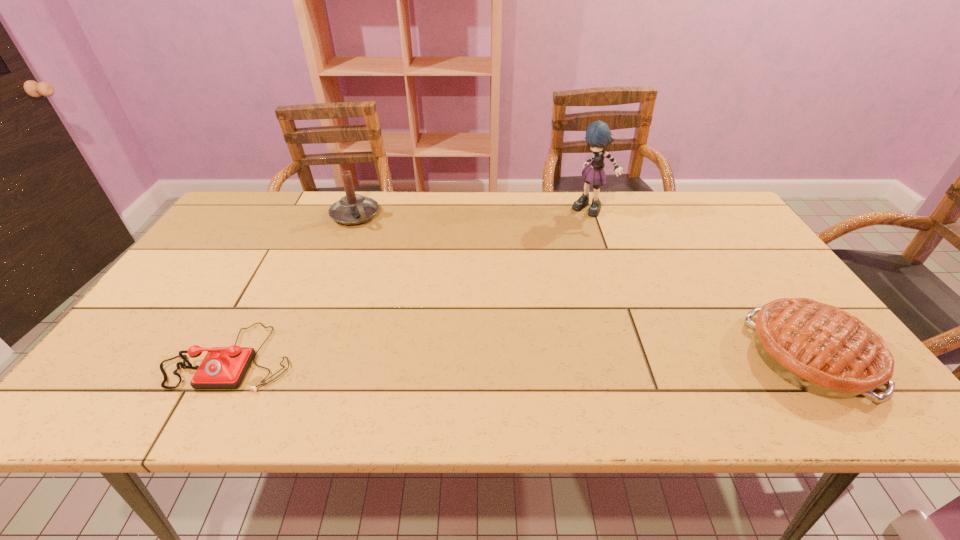
You are a GUI agent. You are given a task and a screenshot of the screen. Output one action in this format:
    pyautogui.click(x=<x>, y=<y>)
    Task: Click on the object located in the near right corner section of the desktop
    This screenshot has width=960, height=540.
    Given the screenshot: What is the action you would take?
    [821, 349]

In the image, there is a desktop. Find the location of `free space at the far edge`. free space at the far edge is located at coordinates (422, 200).

At what (x,y) coordinates should I click in order to perform the action: click on vacant space at the near edge of the desktop. Please return your answer as a coordinate pair (x, y). Looking at the image, I should click on (319, 373).

The height and width of the screenshot is (540, 960). Find the location of `vacant space at the left edge`. vacant space at the left edge is located at coordinates (189, 295).

You are a GUI agent. You are given a task and a screenshot of the screen. Output one action in this format:
    pyautogui.click(x=<x>, y=<y>)
    Task: Click on the blank area at the right edge
    
    Given the screenshot: What is the action you would take?
    pyautogui.click(x=717, y=241)

The height and width of the screenshot is (540, 960). In the image, there is a desktop. In order to click on vacant space at the far left corner in this screenshot , I will do `click(255, 219)`.

I want to click on free location at the far right corner, so click(x=699, y=194).

Find the location of a particular element. The width and height of the screenshot is (960, 540). vacant region between the rightmost object and the rag doll is located at coordinates (700, 283).

Locate an element on the screen. The image size is (960, 540). free area in between the second object from right to left and the candle is located at coordinates (473, 212).

This screenshot has width=960, height=540. I want to click on unoccupied area between the candle and the shortest object, so click(x=294, y=286).